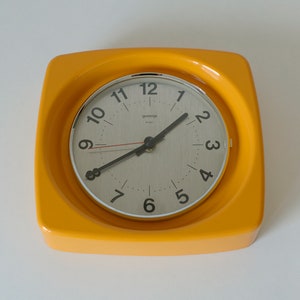
You are a GUI agent. You are given a task and a screenshot of the screen. Output one action in this format:
    pyautogui.click(x=<x>, y=<y>)
    Task: Click on the wall above clock
    
    Given the screenshot: What is the action you would take?
    pyautogui.click(x=147, y=31)